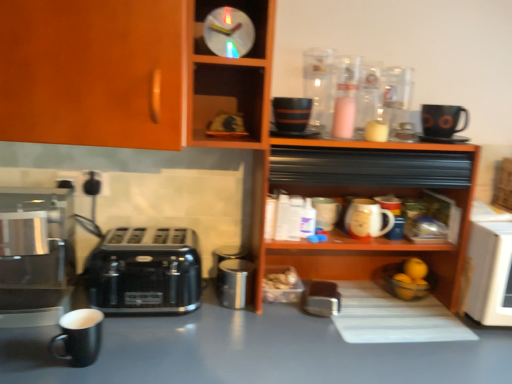
Find the location of a particular element. free point to the right of metallic silver canister at center is located at coordinates (268, 308).